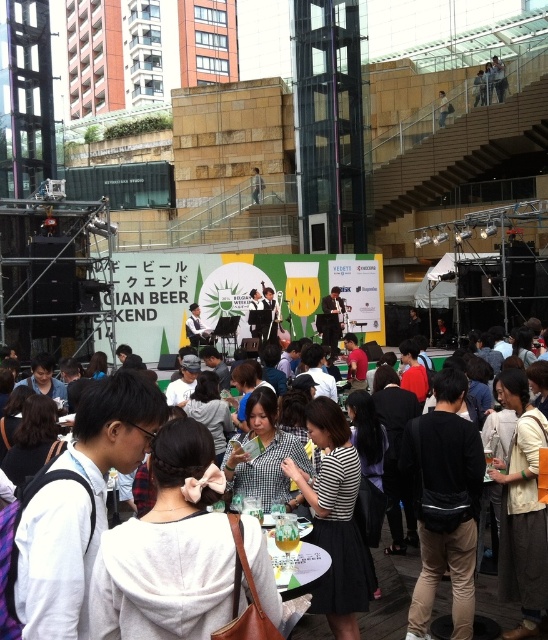
Question: Does light brown wooden chair at center have a smaller size compared to light brown leather bag at upper center?

Choices:
 (A) yes
 (B) no

Answer: (B)

Question: Which point appears closest to the camera in this image?

Choices:
 (A) pyautogui.click(x=442, y=120)
 (B) pyautogui.click(x=256, y=182)

Answer: (A)

Question: Does light brown wooden chair at center come behind light brown leather bag at upper center?

Choices:
 (A) no
 (B) yes

Answer: (B)

Question: Considering the relative positions of light brown wooden chair at center and light brown leather bag at upper center in the image provided, where is light brown wooden chair at center located with respect to light brown leather bag at upper center?

Choices:
 (A) below
 (B) above

Answer: (A)